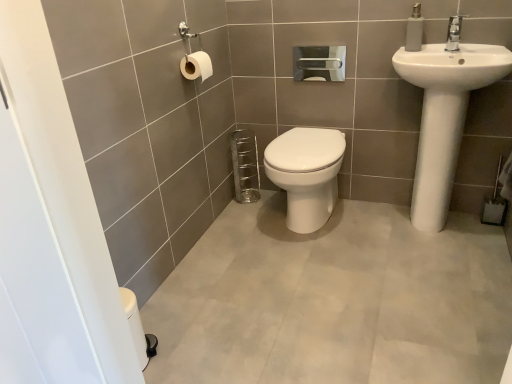
In order to click on free space above white glossy toilet at center (from a real-world perspective) in this screenshot , I will do `click(332, 311)`.